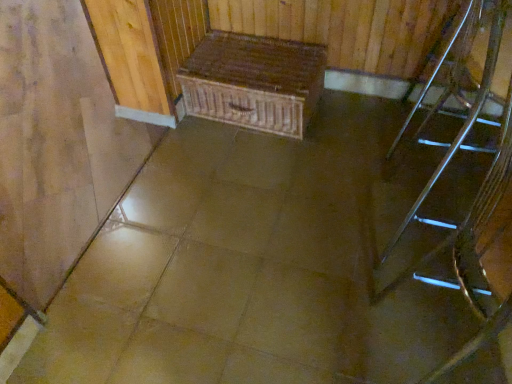
Question: Is metallic silver chair at right far from metallic silver stairs at right?

Choices:
 (A) yes
 (B) no

Answer: (B)

Question: Is metallic silver chair at right positioned before metallic silver stairs at right?

Choices:
 (A) no
 (B) yes

Answer: (A)

Question: From the image's perspective, would you say metallic silver chair at right is shown under metallic silver stairs at right?

Choices:
 (A) no
 (B) yes

Answer: (A)

Question: Is metallic silver chair at right thinner than metallic silver stairs at right?

Choices:
 (A) no
 (B) yes

Answer: (A)

Question: From the image's perspective, would you say metallic silver chair at right is positioned over metallic silver stairs at right?

Choices:
 (A) yes
 (B) no

Answer: (A)

Question: Considering the relative positions of metallic silver chair at right and metallic silver stairs at right in the image provided, is metallic silver chair at right behind metallic silver stairs at right?

Choices:
 (A) yes
 (B) no

Answer: (A)

Question: From a real-world perspective, is wooden chest at center below metallic silver stairs at right?

Choices:
 (A) yes
 (B) no

Answer: (A)

Question: Can you confirm if wooden chest at center is thinner than metallic silver stairs at right?

Choices:
 (A) yes
 (B) no

Answer: (B)

Question: Does wooden chest at center appear on the left side of metallic silver stairs at right?

Choices:
 (A) yes
 (B) no

Answer: (A)

Question: Is wooden chest at center smaller than metallic silver stairs at right?

Choices:
 (A) yes
 (B) no

Answer: (A)

Question: Is metallic silver stairs at right inside wooden chest at center?

Choices:
 (A) yes
 (B) no

Answer: (B)

Question: From a real-world perspective, is wooden chest at center on metallic silver stairs at right?

Choices:
 (A) yes
 (B) no

Answer: (B)

Question: From a real-world perspective, is wooden chest at center on top of metallic silver chair at right?

Choices:
 (A) no
 (B) yes

Answer: (A)